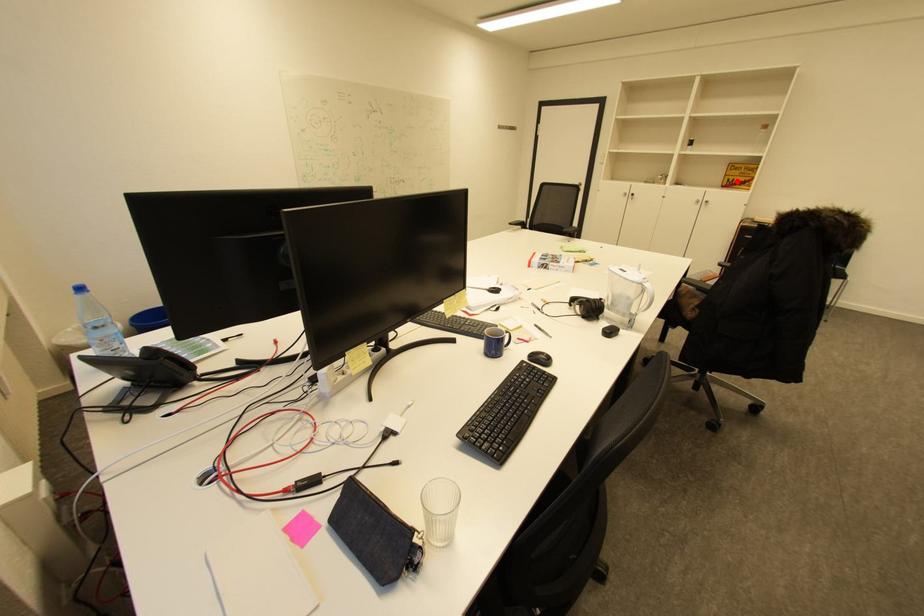
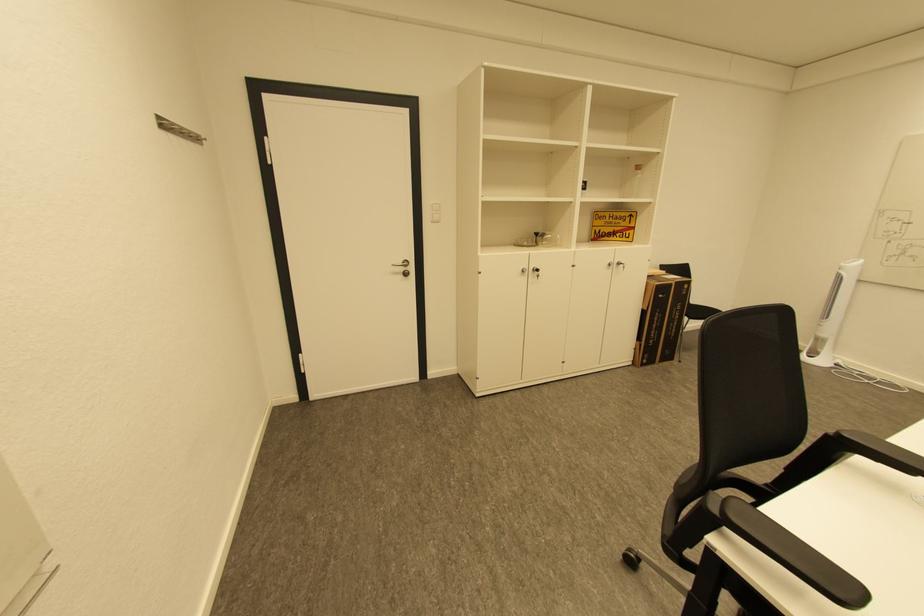
Where in the second image is the point corresponding to the highlighted location from the first image?

(603, 233)